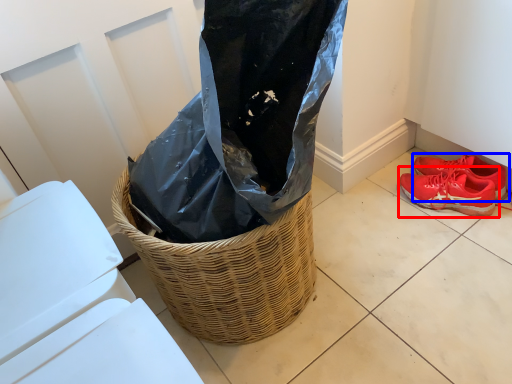
Question: Which of the following is the closest to the observer, footwear (highlighted by a red box) or footwear (highlighted by a blue box)?

Choices:
 (A) footwear
 (B) footwear

Answer: (A)